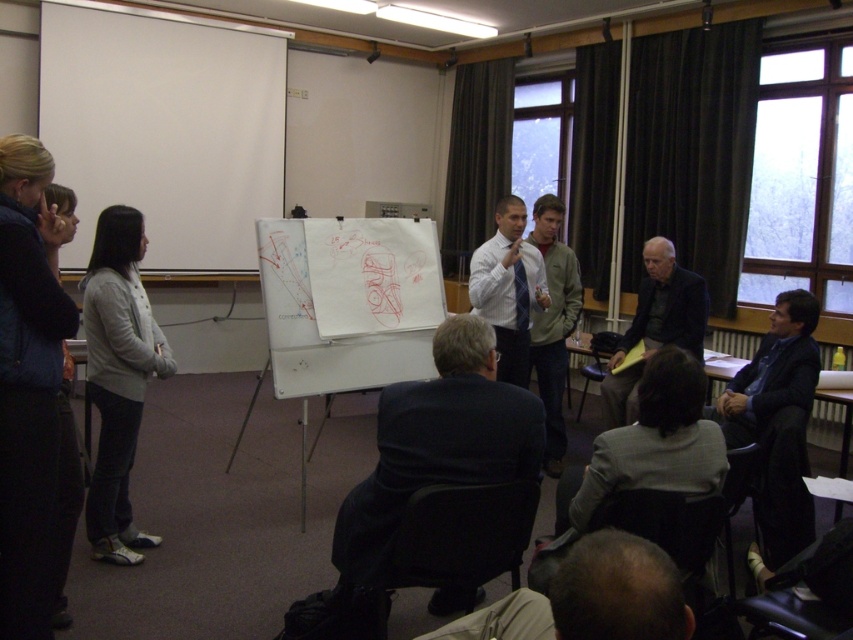
Does white matte board at center have a greater height compared to dark gray sweater at center?

In fact, white matte board at center may be shorter than dark gray sweater at center.

Which is behind, point (306, 305) or point (688, 305)?

The point (688, 305) is more distant.

Which is in front, point (285, 240) or point (653, 310)?

Point (285, 240) is more forward.

Image resolution: width=853 pixels, height=640 pixels. What are the coordinates of `white matte board at center` in the screenshot? It's located at (349, 301).

Who is more forward, (271, 340) or (556, 448)?

Positioned in front is point (271, 340).

Which is in front, point (267, 253) or point (560, 294)?

Point (267, 253) is more forward.

At what (x,y) coordinates should I click in order to perform the action: click on white matte board at center. Please return your answer as a coordinate pair (x, y). The width and height of the screenshot is (853, 640). Looking at the image, I should click on (349, 301).

Where is `white matte board at center`? The width and height of the screenshot is (853, 640). white matte board at center is located at coordinates (349, 301).

Does white matte board at center have a greater height compared to white fabric jacket at left?

In fact, white matte board at center may be shorter than white fabric jacket at left.

Is point (335, 348) in front of point (112, 404)?

No, it is behind (112, 404).

Identify the location of white matte board at center. The height and width of the screenshot is (640, 853). (349, 301).